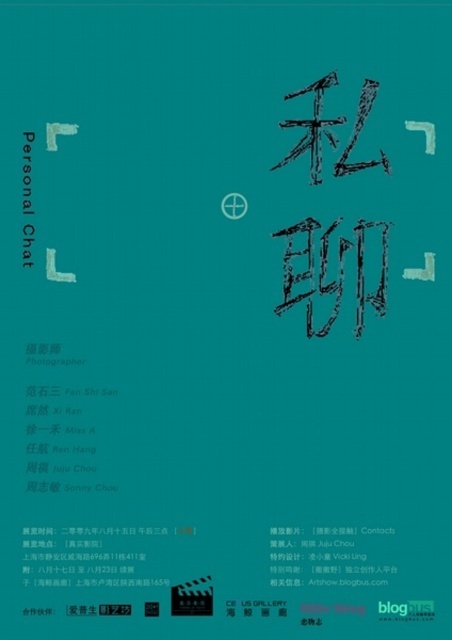
You are standing in front of the poster for the event titled Personal Chat. There is a point at coordinates point (325, 545). If you want to touch this point with your hand, will your hand be closer to you or further away than the teal background?

The point (325, 545) is 5.61 feet from the viewer, so your hand would be closer to you than the teal background since the background is part of the poster and typically at a fixed distance, while the point is at a measurable distance from the viewer.

You are designing a poster and need to place a sticker on the black paper at center. According to the coordinates provided, where exactly should you position the sticker on the poster?

The black paper at center is located at point (324, 556), so you should position the sticker at those coordinates to ensure it is centered on the black paper at center.